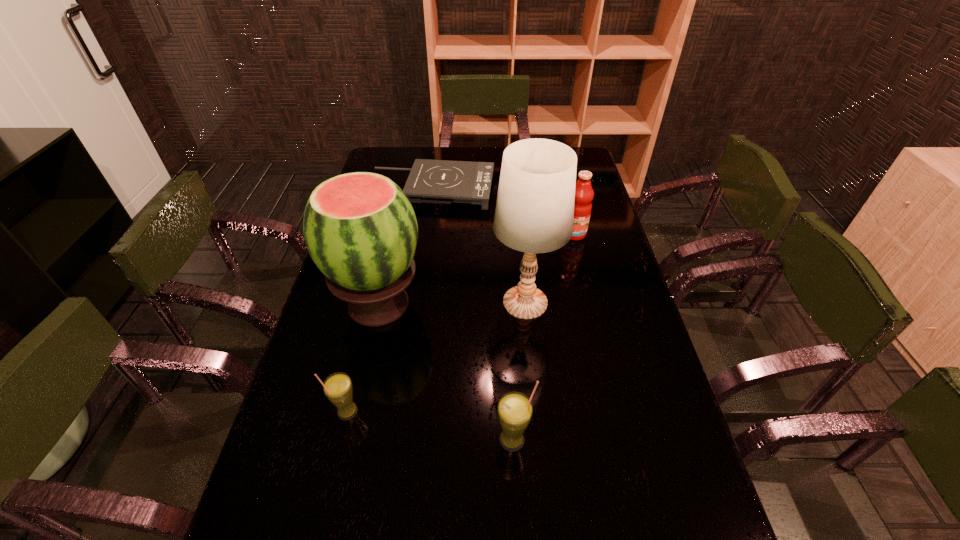
At what (x,y) coordinates should I click in order to perform the action: click on unoccupied area between the fifth nearest object and the tallest object. Please return your answer as a coordinate pair (x, y). The height and width of the screenshot is (540, 960). Looking at the image, I should click on (550, 268).

At what (x,y) coordinates should I click in order to perform the action: click on free point between the fifth nearest object and the right straw for drinking. Please return your answer as a coordinate pair (x, y). Image resolution: width=960 pixels, height=540 pixels. Looking at the image, I should click on (543, 337).

Where is `free spot between the rightmost object and the fifth shortest object`? free spot between the rightmost object and the fifth shortest object is located at coordinates (477, 269).

This screenshot has width=960, height=540. In order to click on vacant space that's between the left straw for drinking and the fifth shortest object in this screenshot , I will do `click(363, 358)`.

Where is `vacant point located between the nearest object and the second tallest object`? This screenshot has width=960, height=540. vacant point located between the nearest object and the second tallest object is located at coordinates (446, 372).

The height and width of the screenshot is (540, 960). I want to click on free spot between the fifth nearest object and the tallest object, so click(x=550, y=268).

Select which object is the fourth closest to the second tallest object. Please provide its 2D coordinates. Your answer should be formatted as a tuple, i.e. [(x, y)], where the tuple contains the x and y coordinates of a point satisfying the conditions above.

[(430, 181)]

Locate which object is the third closest to the shortest object. Please provide its 2D coordinates. Your answer should be formatted as a tuple, i.e. [(x, y)], where the tuple contains the x and y coordinates of a point satisfying the conditions above.

[(534, 213)]

The height and width of the screenshot is (540, 960). I want to click on blank space that satisfies the following two spatial constraints: 1. on the back side of the farthest object; 2. on the right side of the watermelon, so click(404, 189).

Identify the location of vacant region that satisfies the following two spatial constraints: 1. on the front side of the shortest object; 2. on the right side of the nearer straw for drinking. The image size is (960, 540). (398, 440).